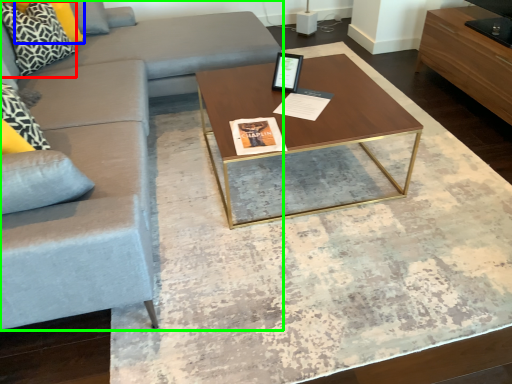
Question: Which is nearer to the pillow (highlighted by a red box)? pillow (highlighted by a blue box) or studio couch (highlighted by a green box).

Choices:
 (A) pillow
 (B) studio couch

Answer: (A)